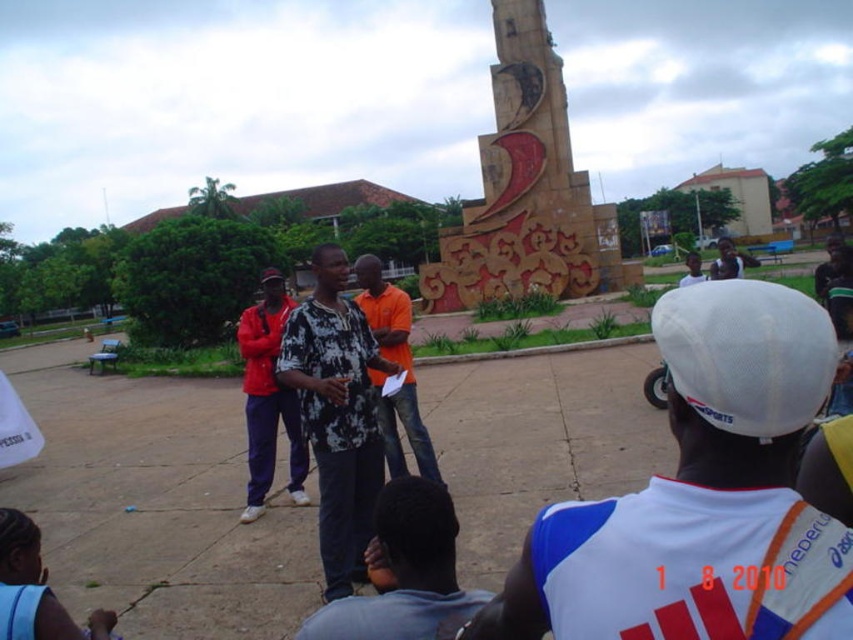
How distant is black printed shirt at center from red fabric pants at center?

The distance of black printed shirt at center from red fabric pants at center is 6.32 meters.

Between black printed shirt at center and red fabric pants at center, which one appears on the left side from the viewer's perspective?

Positioned to the left is red fabric pants at center.

Is point (363, 403) more distant than point (263, 417)?

That is False.

I want to click on black printed shirt at center, so click(x=335, y=413).

Who is taller, dark blue shirt at center or white mesh cap at upper right?

white mesh cap at upper right

Based on the photo, between dark blue shirt at center and white mesh cap at upper right, which one appears on the right side from the viewer's perspective?

Positioned to the right is white mesh cap at upper right.

At what (x,y) coordinates should I click in order to perform the action: click on dark blue shirt at center. Please return your answer as a coordinate pair (x, y). This screenshot has width=853, height=640. Looking at the image, I should click on (404, 572).

Image resolution: width=853 pixels, height=640 pixels. I want to click on dark blue shirt at center, so click(404, 572).

Is black printed shirt at center positioned behind orange cotton shirt at center?

No.

Does point (281, 378) come closer to viewer compared to point (383, 422)?

That is True.

Describe the element at coordinates (335, 413) in the screenshot. I see `black printed shirt at center` at that location.

Identify the location of black printed shirt at center. (335, 413).